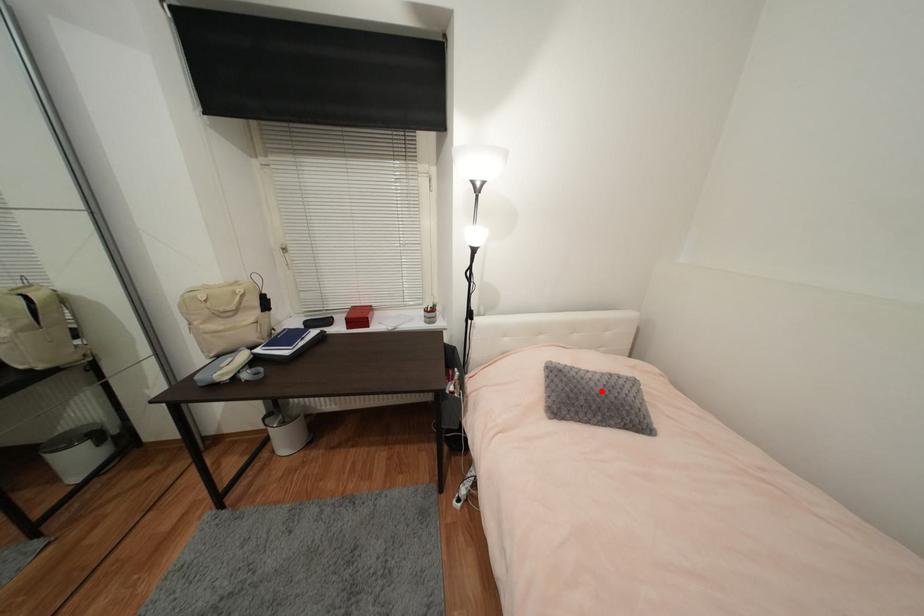
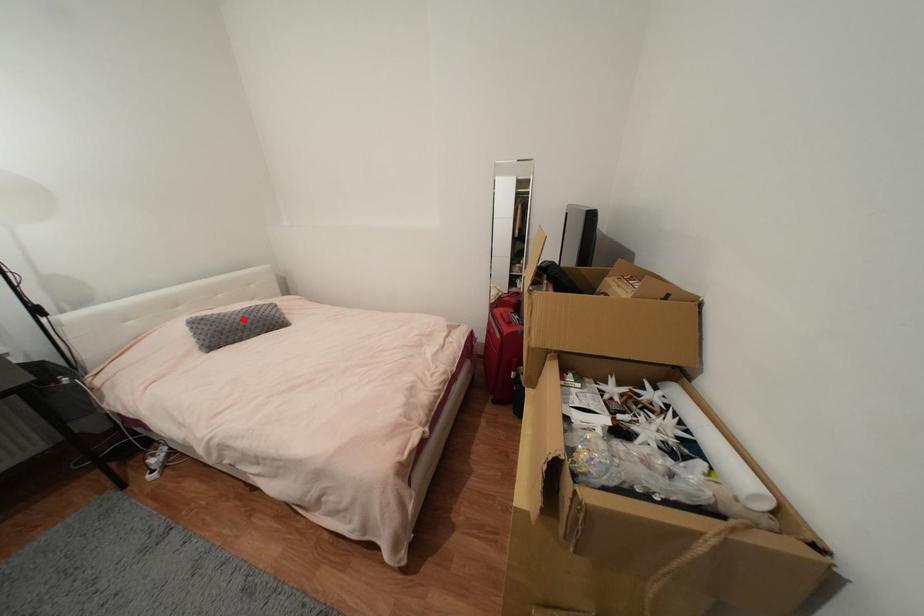
I am providing you with two images of the same scene from different viewpoints. A red point is marked on the first image and another point is marked on the second image. Do the highlighted points in image1 and image2 indicate the same real-world spot?

Yes